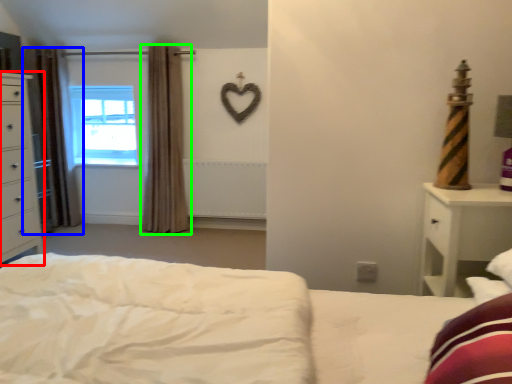
Question: Based on their relative distances, which object is nearer to chest of drawers (highlighted by a red box)? Choose from curtain (highlighted by a blue box) and curtain (highlighted by a green box).

Choices:
 (A) curtain
 (B) curtain

Answer: (A)